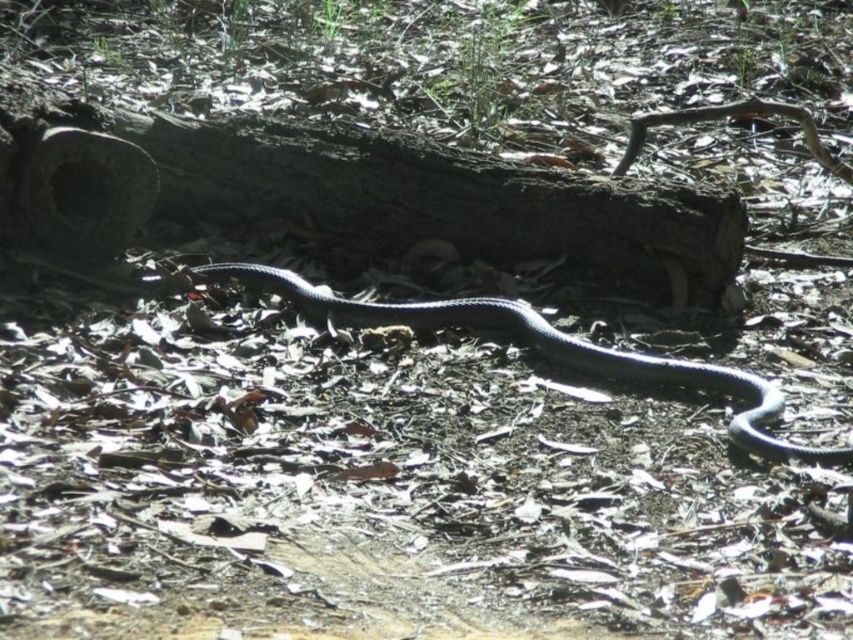
You are an explorer in the forest and want to step on the dark brown rough log at center. Where should you look to find it?

The dark brown rough log at center is located at the 2D coordinates of point (372, 198).

You are an animal tracker observing the forest floor. You notice the dark brown rough log at center and the shiny black snake at center. Which object is positioned higher relative to the other?

The dark brown rough log at center is above the shiny black snake at center.

You are a hiker who has spotted the dark brown rough log at center and the shiny black snake at center in the forest. Which object is bigger in size?

The dark brown rough log at center is larger in size compared to the shiny black snake at center.